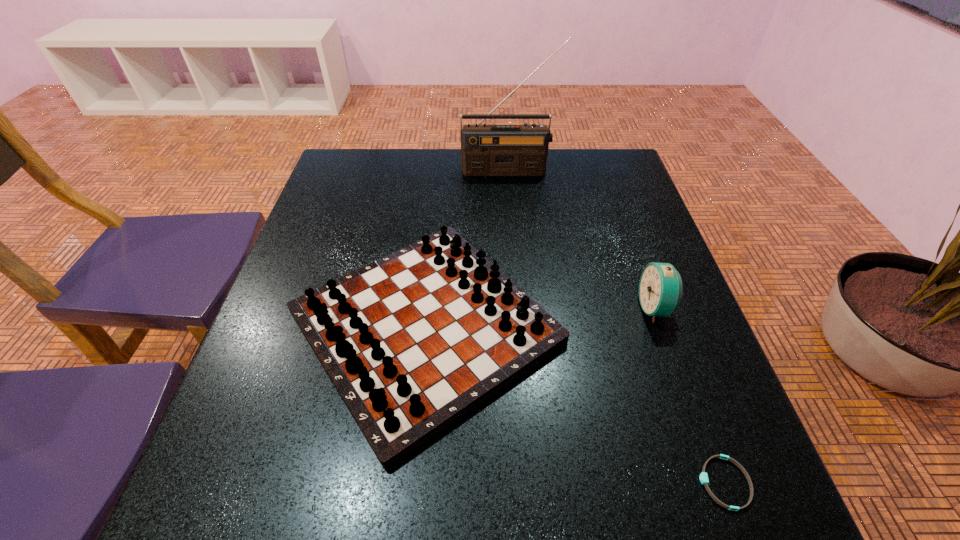
This screenshot has width=960, height=540. I want to click on free location located on the buckle of the shortest object, so click(x=557, y=483).

Locate an element on the screen. free space located 0.250m on the buckle of the shortest object is located at coordinates (537, 483).

Find the location of a particular element. The image size is (960, 540). free space located 0.220m on the buckle of the shortest object is located at coordinates (557, 483).

Where is `object located in the far edge section of the desktop`? object located in the far edge section of the desktop is located at coordinates (486, 150).

At what (x,y) coordinates should I click in order to perform the action: click on chessboard that is at the near edge. Please return your answer as a coordinate pair (x, y). The image size is (960, 540). Looking at the image, I should click on (413, 341).

This screenshot has height=540, width=960. Identify the location of wristband that is at the near edge. (704, 480).

Locate an element on the screen. object situated at the left edge is located at coordinates (413, 341).

Image resolution: width=960 pixels, height=540 pixels. I want to click on alarm clock that is at the right edge, so click(x=660, y=289).

Where is `wristband located at the right edge`? wristband located at the right edge is located at coordinates (704, 480).

At what (x,y) coordinates should I click in order to perform the action: click on object present at the near left corner. Please return your answer as a coordinate pair (x, y). This screenshot has width=960, height=540. Looking at the image, I should click on (413, 341).